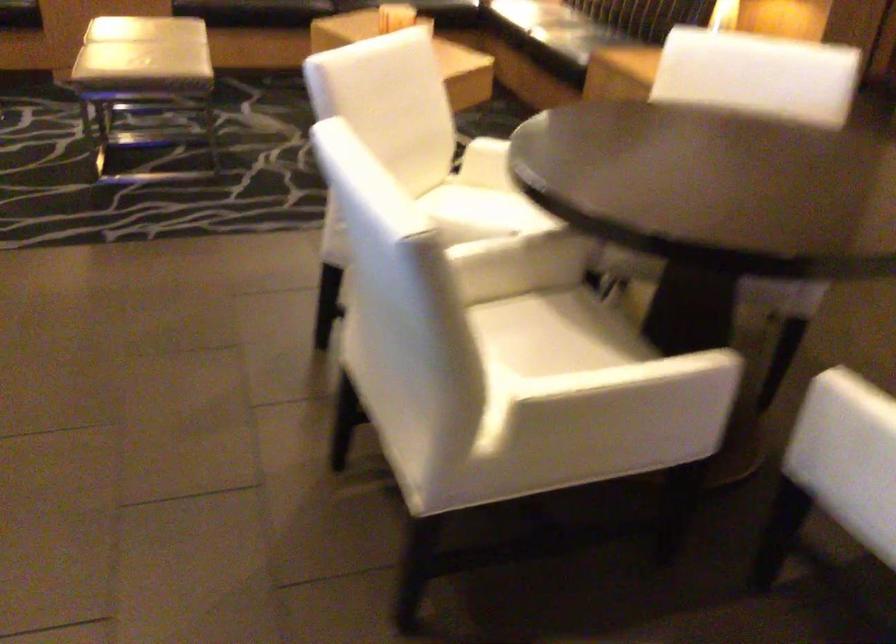
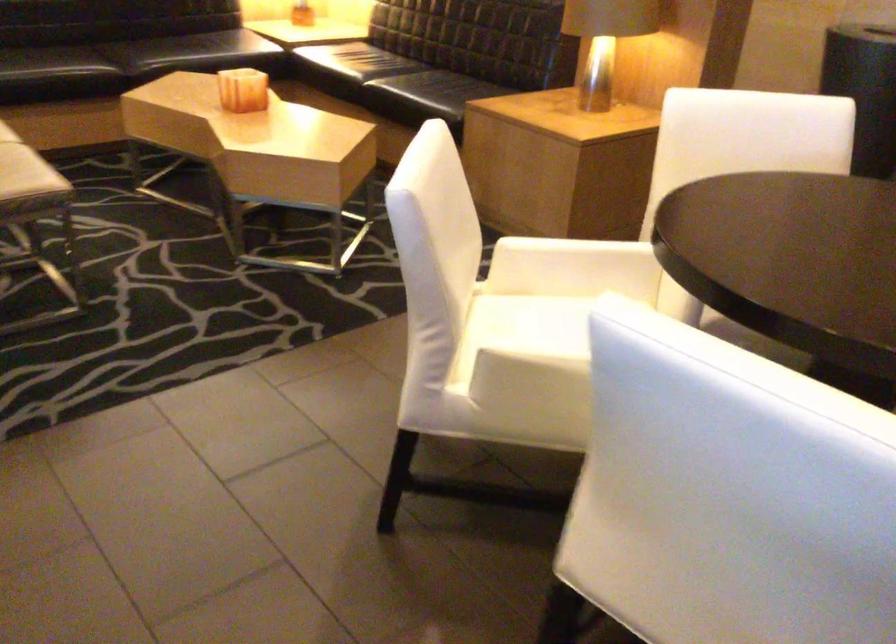
Question: How did the camera likely rotate?

Choices:
 (A) Left
 (B) Right
 (C) Up
 (D) Down

Answer: (B)